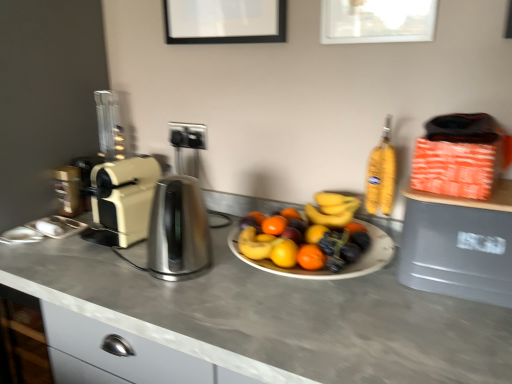
Where is `empty space that is ontop of smooth gray countertop at center`? This screenshot has width=512, height=384. empty space that is ontop of smooth gray countertop at center is located at coordinates (288, 298).